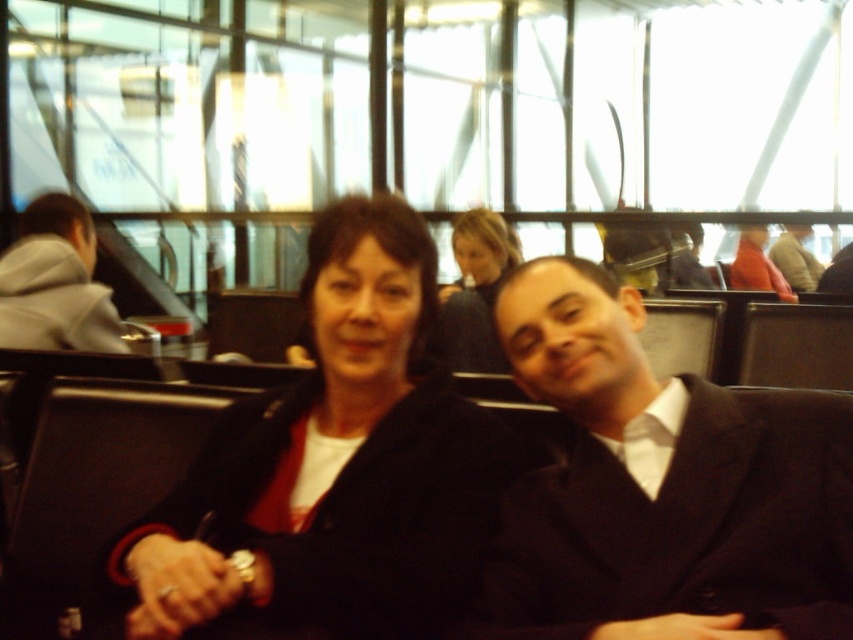
You are a photographer standing at a distance of 5 feet from the scene. You want to take a photo of both the matte black jacket at center and the smooth black hair at center without any blur. Since the camera can only focus on objects within a 4.5 feet range, will you be able to capture both clearly?

The matte black jacket at center is 4.74 feet away from smooth black hair at center. Since the camera can only focus on objects within a 4.5 feet range, the distance between them exceeds the focus range. Therefore, you cannot capture both clearly in the same photo.

You are a photographer setting up a shoot in the waiting area. You need to position a light to the right of both the matte black suit at center and the black matte suit at center. Which direction should you place the light relative to the two suits?

The matte black suit at center is to the left of the black matte suit at center. Therefore, to place the light to the right of both suits, you should position it to the right of the black matte suit at center.

You are a security guard in the airport and need to locate the matte black suit at center. What are the coordinates where you can find it?

The coordinates for the matte black suit at center are 0.728 in the x direction and 0.394 in the y direction.